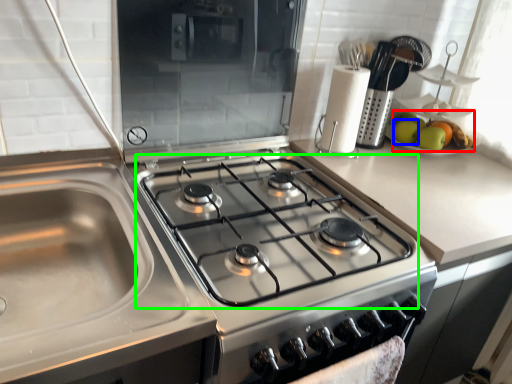
Question: Estimate the real-world distances between objects in this image. Which object is farther from apple (highlighted by a red box), apple (highlighted by a blue box) or gas stove (highlighted by a green box)?

Choices:
 (A) apple
 (B) gas stove

Answer: (B)